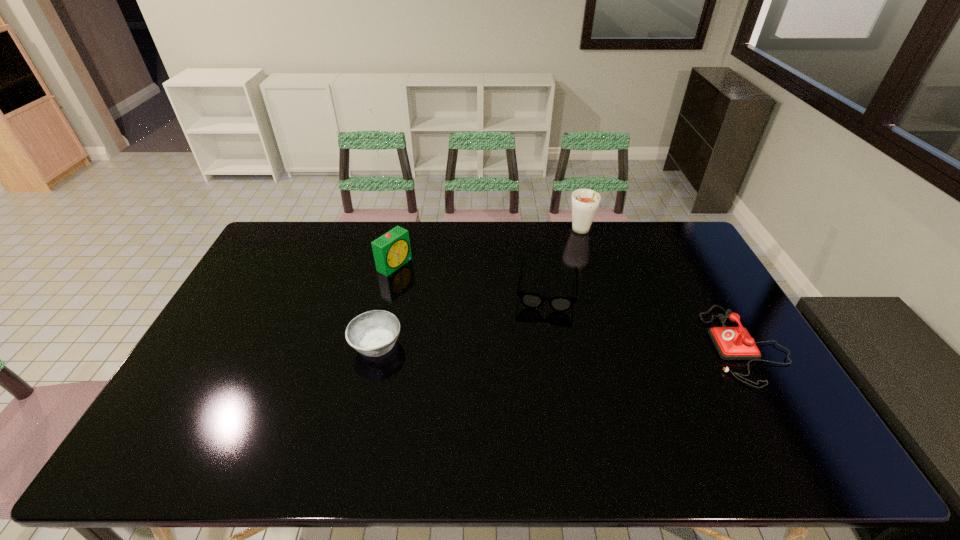
Where is `vacant area that lies between the third object from left to right and the rightmost object`? This screenshot has width=960, height=540. vacant area that lies between the third object from left to right and the rightmost object is located at coordinates (646, 318).

Identify the location of free space between the ashtray and the alarm clock. This screenshot has width=960, height=540. (386, 305).

The width and height of the screenshot is (960, 540). Find the location of `vacant area that lies between the rightmost object and the third object from left to right`. vacant area that lies between the rightmost object and the third object from left to right is located at coordinates (646, 318).

Identify the location of vacant area between the ashtray and the telephone. This screenshot has height=540, width=960. (562, 345).

Where is `vacant region between the third tallest object and the ashtray`? Image resolution: width=960 pixels, height=540 pixels. vacant region between the third tallest object and the ashtray is located at coordinates (562, 345).

Identify the location of object that is the fourth closest to the spectacles. This screenshot has height=540, width=960. (392, 250).

Locate which object is the closest to the ashtray. Please provide its 2D coordinates. Your answer should be formatted as a tuple, i.e. [(x, y)], where the tuple contains the x and y coordinates of a point satisfying the conditions above.

[(392, 250)]

You are a GUI agent. You are given a task and a screenshot of the screen. Output one action in this format:
    pyautogui.click(x=<x>, y=<y>)
    Task: Click on the free space that satisfies the following two spatial constraints: 1. on the front side of the rightmost object; 2. on the dial of the fourth object from left to right
    
    Given the screenshot: What is the action you would take?
    pyautogui.click(x=615, y=345)

The height and width of the screenshot is (540, 960). In order to click on blank space that satisfies the following two spatial constraints: 1. on the front side of the third object from right to left; 2. on the dial of the third shortest object in this screenshot , I will do `click(556, 345)`.

You are a GUI agent. You are given a task and a screenshot of the screen. Output one action in this format:
    pyautogui.click(x=<x>, y=<y>)
    Task: Click on the free space that satisfies the following two spatial constraints: 1. on the back side of the third object from right to left; 2. on the right side of the ashtray
    This screenshot has height=540, width=960.
    Given the screenshot: What is the action you would take?
    pyautogui.click(x=389, y=289)